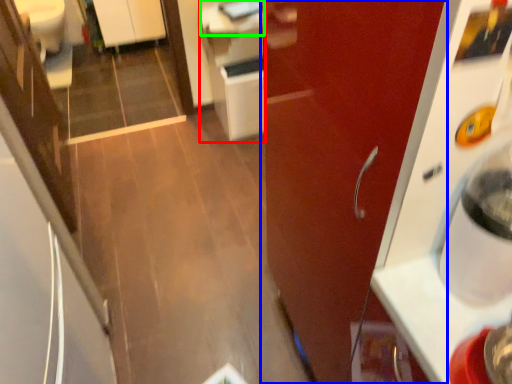
Question: Which object is the closest to the cabinetry (highlighted by a red box)? Choose among these: door (highlighted by a blue box) or counter top (highlighted by a green box).

Choices:
 (A) door
 (B) counter top

Answer: (B)